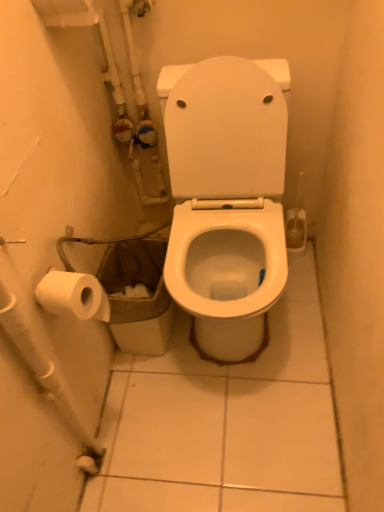
Question: Considering their positions, is white plastic water pipe at lower left located in front of or behind white glossy toilet at center?

Choices:
 (A) front
 (B) behind

Answer: (A)

Question: Is white plastic water pipe at lower left bigger or smaller than white glossy toilet at center?

Choices:
 (A) big
 (B) small

Answer: (B)

Question: Which is nearer to the white glossy toilet at center?

Choices:
 (A) white plastic water pipe at lower left
 (B) brown paper bag at lower left

Answer: (B)

Question: Which is farther from the white plastic water pipe at lower left?

Choices:
 (A) brown paper bag at lower left
 (B) white glossy toilet at center

Answer: (B)